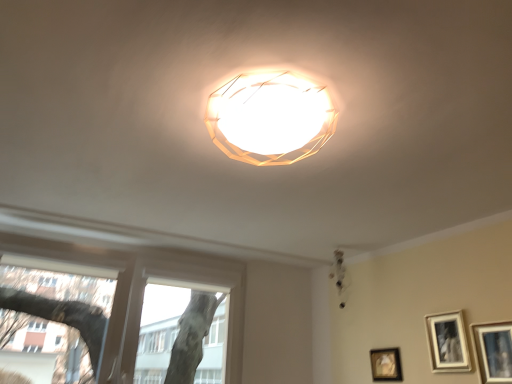
What do you see at coordinates (493, 351) in the screenshot? I see `matte black picture frame at lower right, the first picture frame positioned from the right` at bounding box center [493, 351].

The height and width of the screenshot is (384, 512). I want to click on matte black picture frame at lower right, arranged as the 3th picture frame when viewed from the left, so click(493, 351).

Locate an element on the screen. matte black picture frame at lower right, which ranks as the third picture frame in right-to-left order is located at coordinates (386, 364).

Where is `matte white chandelier at upper center`? The height and width of the screenshot is (384, 512). matte white chandelier at upper center is located at coordinates (339, 275).

Locate an element on the screen. This screenshot has height=384, width=512. matte black picture frame at lower right, positioned as the 1th picture frame in front-to-back order is located at coordinates (493, 351).

Does transparent glass window at lower left have a smaller size compared to matte black picture frame at lower right, the 3th picture frame from the front?

Incorrect, transparent glass window at lower left is not smaller in size than matte black picture frame at lower right, the 3th picture frame from the front.

Which of these two, transparent glass window at lower left or matte black picture frame at lower right, which ranks as the third picture frame in right-to-left order, stands taller?

Standing taller between the two is transparent glass window at lower left.

From the picture: From the image's perspective, which is above, transparent glass window at lower left or matte black picture frame at lower right, which appears as the 1th picture frame when viewed from the back?

transparent glass window at lower left.

Does transparent glass window at lower left have a greater width compared to matte black picture frame at lower right, which ranks as the third picture frame in right-to-left order?

Yes.

Is matte silver picture frame at lower right, the 2th picture frame when ordered from left to right, facing away from matte black picture frame at lower right, the first picture frame positioned from the right?

matte silver picture frame at lower right, the 2th picture frame when ordered from left to right, does not have its back to matte black picture frame at lower right, the first picture frame positioned from the right.

Consider the image. Considering the sizes of objects matte silver picture frame at lower right, the 2th picture frame when ordered from left to right, and matte black picture frame at lower right, arranged as the 3th picture frame when viewed from the left, in the image provided, who is smaller, matte silver picture frame at lower right, the 2th picture frame when ordered from left to right, or matte black picture frame at lower right, arranged as the 3th picture frame when viewed from the left,?

With smaller size is matte silver picture frame at lower right, the 2th picture frame when ordered from left to right.

Is point (458, 351) less distant than point (508, 347)?

That is False.

From the image's perspective, between matte silver picture frame at lower right, which is the 2th picture frame in right-to-left order, and matte white chandelier at upper center, who is located below?

matte silver picture frame at lower right, which is the 2th picture frame in right-to-left order.

In the scene shown: Is there a large distance between matte silver picture frame at lower right, the 2th picture frame when ordered from left to right, and matte white chandelier at upper center?

No, matte silver picture frame at lower right, the 2th picture frame when ordered from left to right, is not far from matte white chandelier at upper center.

Is matte silver picture frame at lower right, which is the 2th picture frame in right-to-left order, shorter than matte white chandelier at upper center?

Yes, matte silver picture frame at lower right, which is the 2th picture frame in right-to-left order, is shorter than matte white chandelier at upper center.

Which is more to the left, matte silver picture frame at lower right, which is counted as the 2th picture frame, starting from the front, or matte white chandelier at upper center?

matte white chandelier at upper center is more to the left.

Does matte black picture frame at lower right, which appears as the 1th picture frame when viewed from the back, appear on the left side of matte silver picture frame at lower right, which is the 2th picture frame in right-to-left order?

Indeed, matte black picture frame at lower right, which appears as the 1th picture frame when viewed from the back, is positioned on the left side of matte silver picture frame at lower right, which is the 2th picture frame in right-to-left order.

Measure the distance from matte black picture frame at lower right, which ranks as the third picture frame in right-to-left order, to matte silver picture frame at lower right, which is the 2th picture frame in right-to-left order.

A distance of 34.85 centimeters exists between matte black picture frame at lower right, which ranks as the third picture frame in right-to-left order, and matte silver picture frame at lower right, which is the 2th picture frame in right-to-left order.

Considering the relative sizes of matte black picture frame at lower right, the 3th picture frame from the front, and matte silver picture frame at lower right, the 2th picture frame when ordered from left to right, in the image provided, is matte black picture frame at lower right, the 3th picture frame from the front, thinner than matte silver picture frame at lower right, the 2th picture frame when ordered from left to right,?

Yes.

Based on the photo, is matte black picture frame at lower right, which appears as the 1th picture frame when viewed from the back, in front of or behind matte silver picture frame at lower right, which appears as the 2th picture frame when viewed from the back, in the image?

matte black picture frame at lower right, which appears as the 1th picture frame when viewed from the back, is positioned farther from the viewer than matte silver picture frame at lower right, which appears as the 2th picture frame when viewed from the back.

From the image's perspective, does matte white chandelier at upper center appear higher than matte black picture frame at lower right, which appears as the 1th picture frame when viewed from the back?

Yes, from the image's perspective, matte white chandelier at upper center is on top of matte black picture frame at lower right, which appears as the 1th picture frame when viewed from the back.

Which is behind, matte white chandelier at upper center or matte black picture frame at lower right, positioned as the first picture frame in left-to-right order?

matte white chandelier at upper center.

Are matte white chandelier at upper center and matte black picture frame at lower right, the 3th picture frame from the front, located far from each other?

That's not correct — matte white chandelier at upper center is a little close to matte black picture frame at lower right, the 3th picture frame from the front.

Does matte white chandelier at upper center turn towards matte black picture frame at lower right, positioned as the first picture frame in left-to-right order?

No, matte white chandelier at upper center is not oriented towards matte black picture frame at lower right, positioned as the first picture frame in left-to-right order.

From the picture: How much distance is there between transparent glass window at lower left and matte black picture frame at lower right, which is the 3th picture frame in back-to-front order?

They are 1.70 meters apart.

The width and height of the screenshot is (512, 384). Identify the location of bay window below the matte black picture frame at lower right, arranged as the 3th picture frame when viewed from the left (from the image's perspective). (159, 331).

Consider the image. Considering the relative sizes of transparent glass window at lower left and matte black picture frame at lower right, arranged as the 3th picture frame when viewed from the left, in the image provided, is transparent glass window at lower left shorter than matte black picture frame at lower right, arranged as the 3th picture frame when viewed from the left,?

No.

Can we say transparent glass window at lower left lies outside matte black picture frame at lower right, arranged as the 3th picture frame when viewed from the left?

transparent glass window at lower left is positioned outside matte black picture frame at lower right, arranged as the 3th picture frame when viewed from the left.

Is matte black picture frame at lower right, which is the 3th picture frame in back-to-front order, closer to camera compared to matte black picture frame at lower right, the 3th picture frame from the front?

Yes, matte black picture frame at lower right, which is the 3th picture frame in back-to-front order, is closer to the viewer.

Looking at this image, considering the positions of objects matte black picture frame at lower right, which is the 3th picture frame in back-to-front order, and matte black picture frame at lower right, which appears as the 1th picture frame when viewed from the back, in the image provided, who is more to the left, matte black picture frame at lower right, which is the 3th picture frame in back-to-front order, or matte black picture frame at lower right, which appears as the 1th picture frame when viewed from the back,?

Positioned to the left is matte black picture frame at lower right, which appears as the 1th picture frame when viewed from the back.

Starting from the matte black picture frame at lower right, which appears as the 1th picture frame when viewed from the back, which picture frame is the 2nd one to the right? Please provide its 2D coordinates.

[(493, 351)]

From the image's perspective, is matte black picture frame at lower right, arranged as the 3th picture frame when viewed from the left, on top of matte black picture frame at lower right, the 3th picture frame from the front?

Indeed, from the image's perspective, matte black picture frame at lower right, arranged as the 3th picture frame when viewed from the left, is shown above matte black picture frame at lower right, the 3th picture frame from the front.

This screenshot has height=384, width=512. Identify the location of bay window above the matte black picture frame at lower right, which ranks as the third picture frame in right-to-left order (from the image's perspective). (159, 331).

Locate an element on the screen. Image resolution: width=512 pixels, height=384 pixels. picture frame lying in front of the matte silver picture frame at lower right, the 2th picture frame when ordered from left to right is located at coordinates (493, 351).

Based on their spatial positions, is matte white chandelier at upper center or matte black picture frame at lower right, the 3th picture frame from the front, further from matte silver picture frame at lower right, which appears as the 2th picture frame when viewed from the back?

Based on the image, matte white chandelier at upper center appears to be further to matte silver picture frame at lower right, which appears as the 2th picture frame when viewed from the back.

From the image, which object appears to be nearer to matte black picture frame at lower right, which is the 3th picture frame in back-to-front order, matte silver picture frame at lower right, the 2th picture frame when ordered from left to right, or matte white chandelier at upper center?

matte silver picture frame at lower right, the 2th picture frame when ordered from left to right, is closer to matte black picture frame at lower right, which is the 3th picture frame in back-to-front order.

Based on their spatial positions, is matte white chandelier at upper center or matte black picture frame at lower right, positioned as the 1th picture frame in front-to-back order, further from matte black picture frame at lower right, positioned as the first picture frame in left-to-right order?

matte black picture frame at lower right, positioned as the 1th picture frame in front-to-back order.

From the image, which object appears to be nearer to matte black picture frame at lower right, which is the 3th picture frame in back-to-front order, transparent glass window at lower left or matte white chandelier at upper center?

matte white chandelier at upper center lies closer to matte black picture frame at lower right, which is the 3th picture frame in back-to-front order, than the other object.

When comparing their distances from transparent glass window at lower left, does matte silver picture frame at lower right, which is the 2th picture frame in right-to-left order, or matte black picture frame at lower right, which ranks as the third picture frame in right-to-left order, seem further?

The object further to transparent glass window at lower left is matte silver picture frame at lower right, which is the 2th picture frame in right-to-left order.

Which object lies nearer to the anchor point matte black picture frame at lower right, which appears as the 1th picture frame when viewed from the back, transparent glass window at lower left or matte white chandelier at upper center?

matte white chandelier at upper center lies closer to matte black picture frame at lower right, which appears as the 1th picture frame when viewed from the back, than the other object.

Estimate the real-world distances between objects in this image. Which object is further from transparent glass window at lower left, matte silver picture frame at lower right, which is the 2th picture frame in right-to-left order, or matte white chandelier at upper center?

Among the two, matte silver picture frame at lower right, which is the 2th picture frame in right-to-left order, is located further to transparent glass window at lower left.

Looking at the image, which one is located closer to matte silver picture frame at lower right, which is counted as the 2th picture frame, starting from the front, matte white chandelier at upper center or transparent glass window at lower left?

matte white chandelier at upper center is positioned closer to the anchor matte silver picture frame at lower right, which is counted as the 2th picture frame, starting from the front.

Find the location of a particular element. The image size is (512, 384). picture frame between matte silver picture frame at lower right, which appears as the 2th picture frame when viewed from the back, and matte white chandelier at upper center from front to back is located at coordinates (386, 364).

Locate an element on the screen. This screenshot has height=384, width=512. picture frame between matte black picture frame at lower right, which is the 3th picture frame in back-to-front order, and matte black picture frame at lower right, the 3th picture frame from the front, from front to back is located at coordinates (448, 342).

The image size is (512, 384). I want to click on lamp situated between transparent glass window at lower left and matte black picture frame at lower right, which is the 3th picture frame in back-to-front order, from left to right, so click(x=339, y=275).

In order to click on picture frame situated between transparent glass window at lower left and matte silver picture frame at lower right, which appears as the 2th picture frame when viewed from the back, from left to right in this screenshot , I will do `click(386, 364)`.